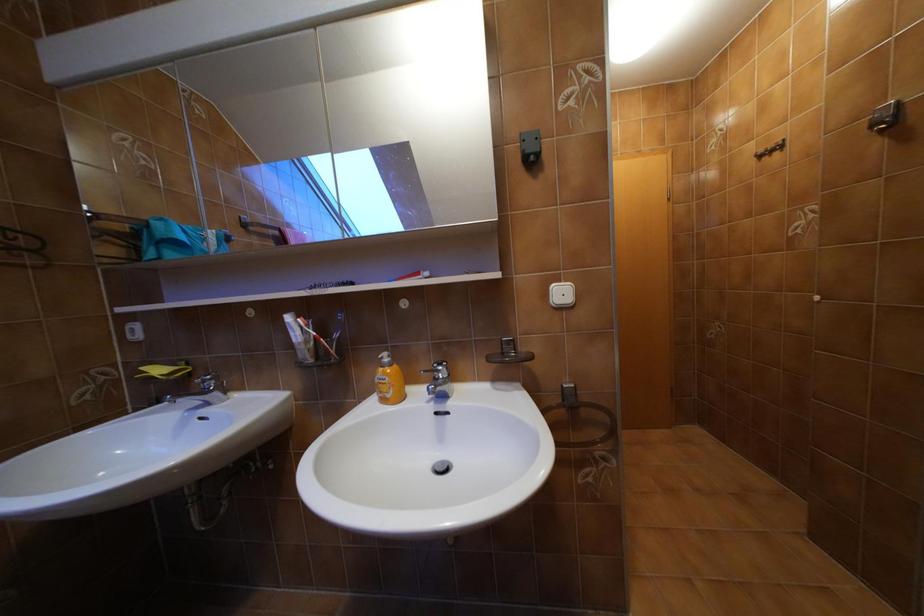
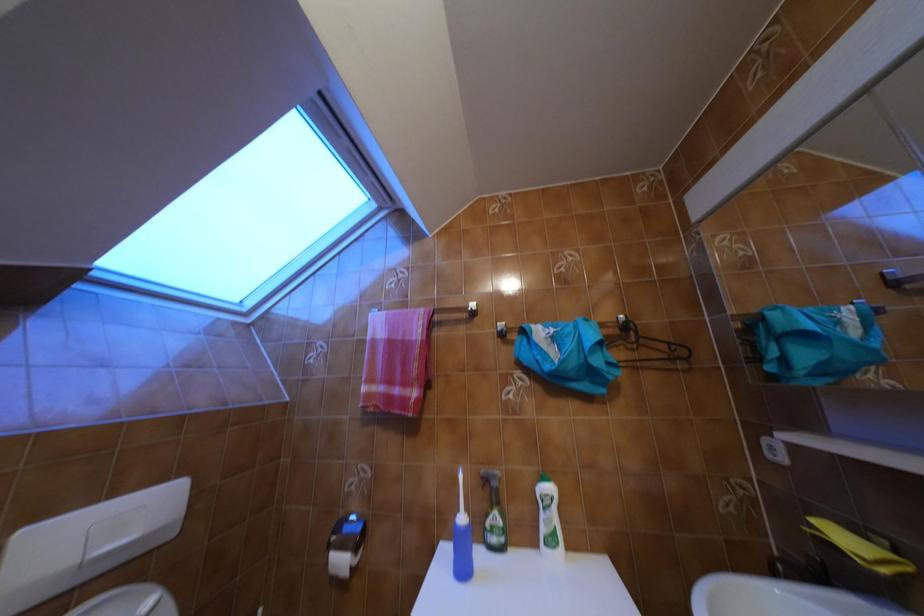
Question: The first image is from the beginning of the video and the second image is from the end. How did the camera likely rotate when shooting the video?

Choices:
 (A) Left
 (B) Right
 (C) Up
 (D) Down

Answer: (A)